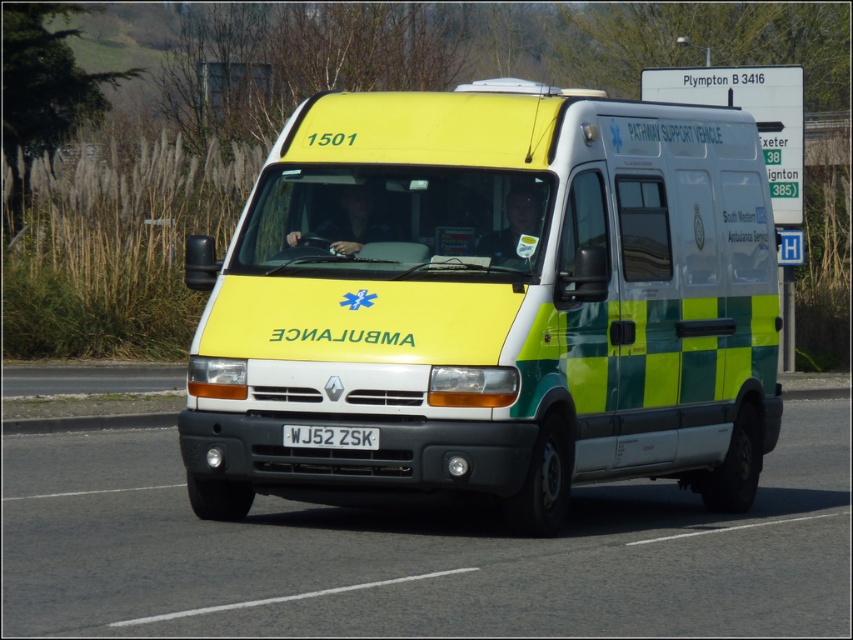
You are a passenger in the ambulance and want to know which of the two points, point (770, 225) or point (531, 632), is closer to you. Based on the scene description, which point is nearer?

Point (770, 225) is further to the viewer than point (531, 632), so the point closer to you is point (531, 632).